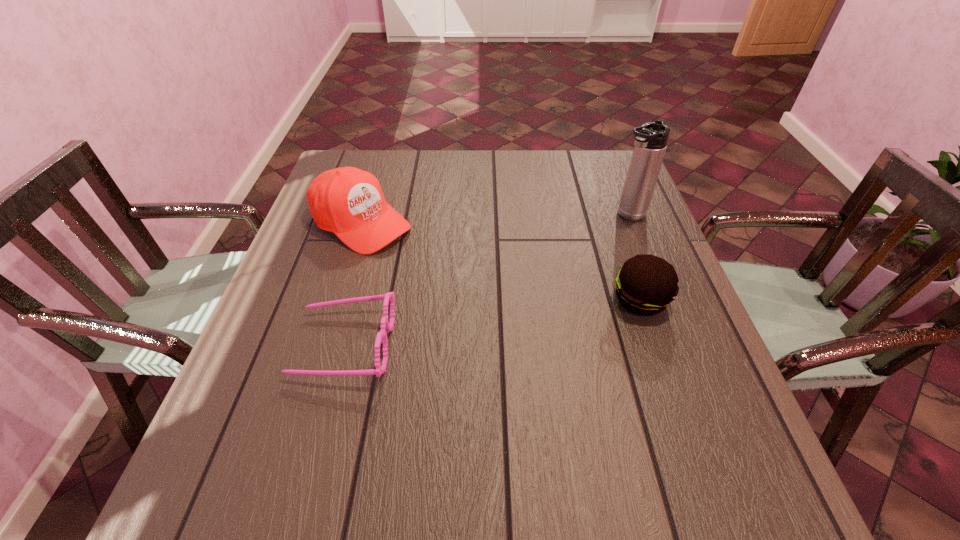
The height and width of the screenshot is (540, 960). What are the coordinates of `the shortest object` in the screenshot? It's located at (381, 337).

I want to click on the second shortest object, so click(646, 284).

This screenshot has height=540, width=960. Find the location of `thermos bottle`. thermos bottle is located at coordinates (651, 139).

At what (x,y) coordinates should I click in order to perform the action: click on the second tallest object. Please return your answer as a coordinate pair (x, y). The width and height of the screenshot is (960, 540). Looking at the image, I should click on (349, 202).

Locate an element on the screen. vacant space located on the arms of the shortest object is located at coordinates (262, 344).

You are a GUI agent. You are given a task and a screenshot of the screen. Output one action in this format:
    pyautogui.click(x=<x>, y=<y>)
    Task: Click on the free spot located 0.060m on the arms of the shortest object
    The image size is (960, 540).
    Given the screenshot: What is the action you would take?
    pyautogui.click(x=267, y=344)

At what (x,y) coordinates should I click in order to perform the action: click on blank area located 0.070m on the front of the second shortest object. Please return your answer as a coordinate pair (x, y). Looking at the image, I should click on (658, 350).

In order to click on free location located on the handle side of the thermos bottle in this screenshot , I will do `click(533, 279)`.

The width and height of the screenshot is (960, 540). Find the location of `free spot located 0.230m on the handle side of the thermos bottle`. free spot located 0.230m on the handle side of the thermos bottle is located at coordinates coord(559,262).

Where is `vacant space situated on the handle side of the thermos bottle`? vacant space situated on the handle side of the thermos bottle is located at coordinates (594, 238).